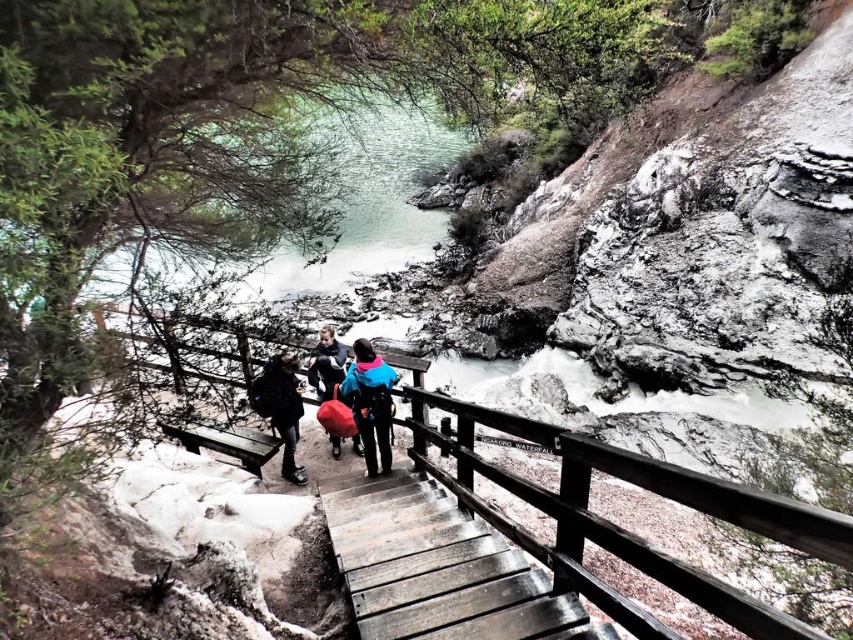
You are planning to take a photo of the blue fleece jacket at center and the dark gray fabric backpack at center from the boardwalk. Which object should you focus on first if you want to capture both in the frame without moving the camera?

The blue fleece jacket at center should be focused on first because it is wider than the dark gray fabric backpack at center, ensuring it fits within the frame while the backpack remains in view.

You are standing at the point marked by the coordinates point (438, 566) in the image, which is at wooden stairs at center. You want to walk down to the river below. Which direction should you go?

The wooden stairs at center marked by point (438, 566) lead down towards the river below, so you should go down the stairs to reach the river.

You are a photographer standing on the wooden boardwalk. You notice the blue fleece jacket at center and the dark gray fabric backpack at center in your viewfinder. Which object appears taller in the photo?

The blue fleece jacket at center appears taller than the dark gray fabric backpack at center in the photo.